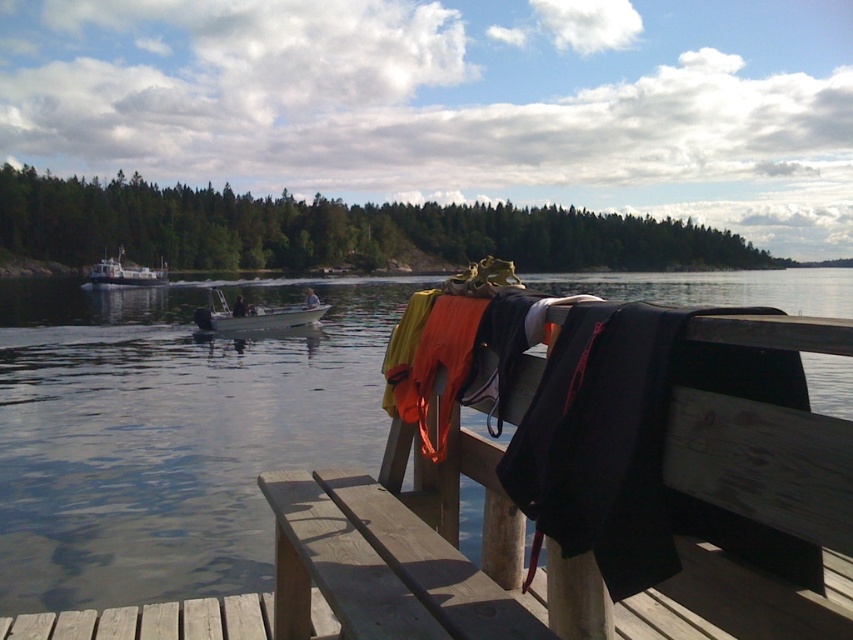
You are standing on the wooden dock and want to retrieve the white plastic boat at center. The smooth water at dock center is between you and the boat. Can you reach the boat without stepping into the water?

The smooth water at dock center is closer to the viewer than the white plastic boat at center, so the boat is further away. Since the water is in between, you would need to step onto the water to reach it, which isn

You are standing on the wooden dock and want to check the water level relative to the boat. Which object, the smooth water at dock center or the white plastic boat at left, is higher in elevation?

The smooth water at dock center is taller than the white plastic boat at left, so the smooth water at dock center is higher in elevation.

You are standing at the point marked as point (166, 435) and want to walk to the wooden bench with a dark jacket. Is the path clear? Please explain.

The point (166, 435) corresponds to smooth water at dock center. The wooden bench with a dark jacket is on the dock. Since the dock is a solid structure, you can walk from the water point to the bench along the dock without obstacles.